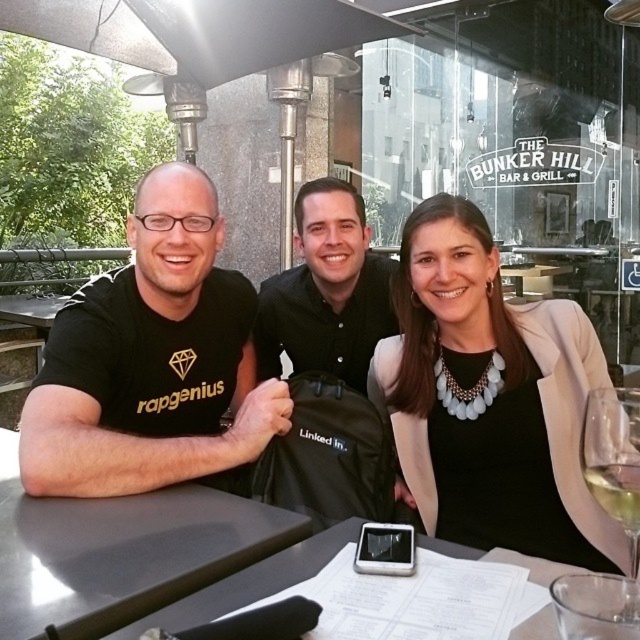
The width and height of the screenshot is (640, 640). What do you see at coordinates (490, 397) in the screenshot?
I see `black fabric jacket at center` at bounding box center [490, 397].

What do you see at coordinates (490, 397) in the screenshot? The image size is (640, 640). I see `black fabric jacket at center` at bounding box center [490, 397].

The width and height of the screenshot is (640, 640). In order to click on black fabric jacket at center in this screenshot , I will do `click(490, 397)`.

Is clear glass wine glass at lower right bigger than white paper at center?

No, clear glass wine glass at lower right is not bigger than white paper at center.

Identify the location of clear glass wine glass at lower right. The image size is (640, 640). (616, 474).

I want to click on clear glass wine glass at lower right, so click(616, 474).

Does black fabric jacket at center appear under clear glass wine glass at lower right?

No.

Does black fabric jacket at center have a greater width compared to clear glass wine glass at lower right?

Correct, the width of black fabric jacket at center exceeds that of clear glass wine glass at lower right.

Is point (458, 499) farther from camera compared to point (582, 460)?

Yes, point (458, 499) is behind point (582, 460).

This screenshot has width=640, height=640. What are the coordinates of `black fabric jacket at center` in the screenshot? It's located at (490, 397).